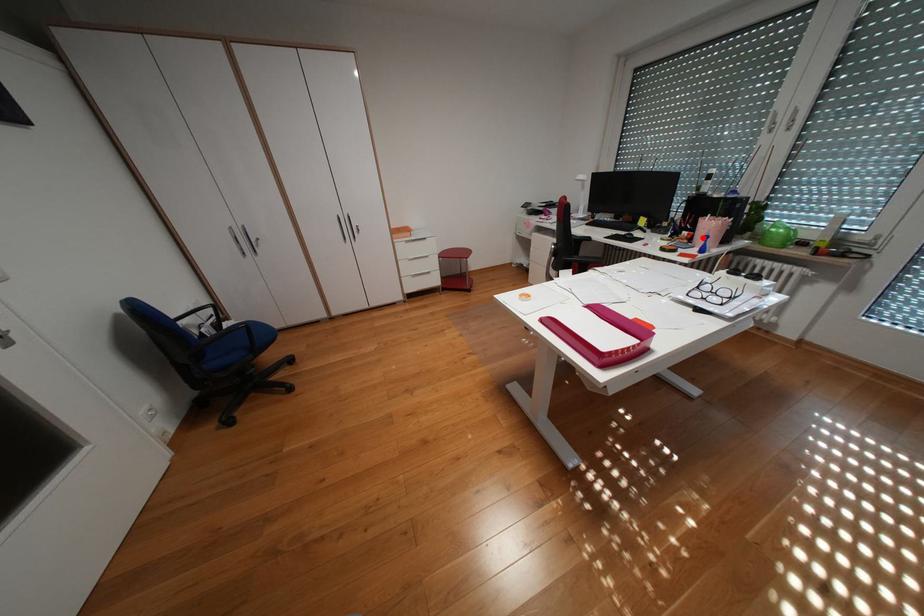
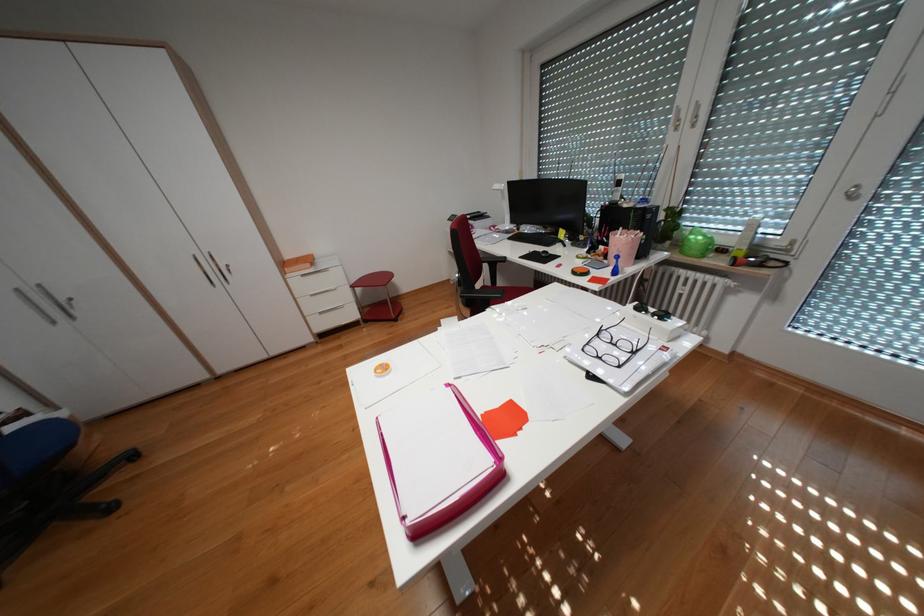
Locate, in the second image, the point that corresponds to the highlighted location in the first image.

(618, 254)